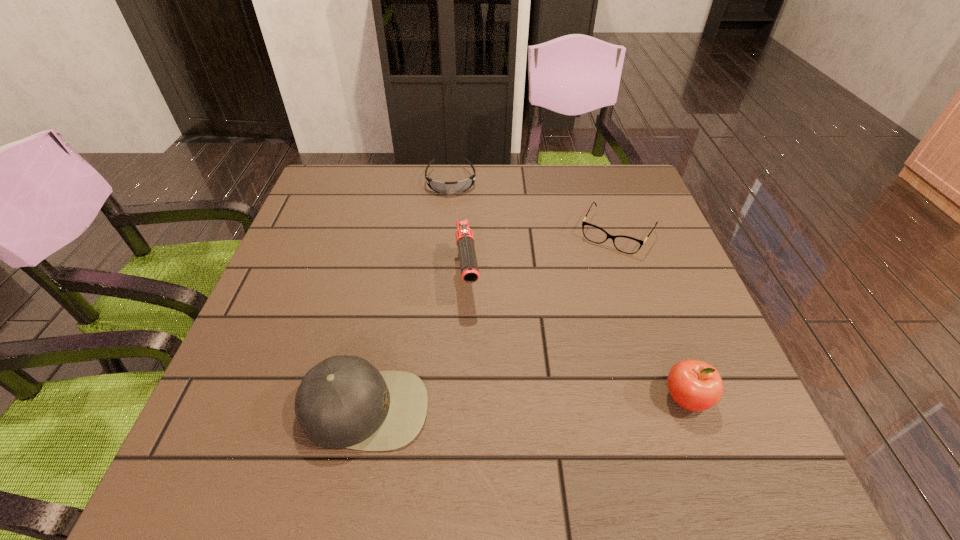
The height and width of the screenshot is (540, 960). What are the coordinates of `free space on the desktop that is between the cap and the apple and is positioned on the front-facing side of the spectacles` in the screenshot? It's located at (518, 404).

Locate an element on the screen. free space on the desktop that is between the cap and the apple and is positioned at the aiming end of the gun is located at coordinates (486, 405).

Where is `free space on the desktop that is between the cap and the apple and is positioned on the lenses of the sunglasses`? free space on the desktop that is between the cap and the apple and is positioned on the lenses of the sunglasses is located at coordinates (481, 405).